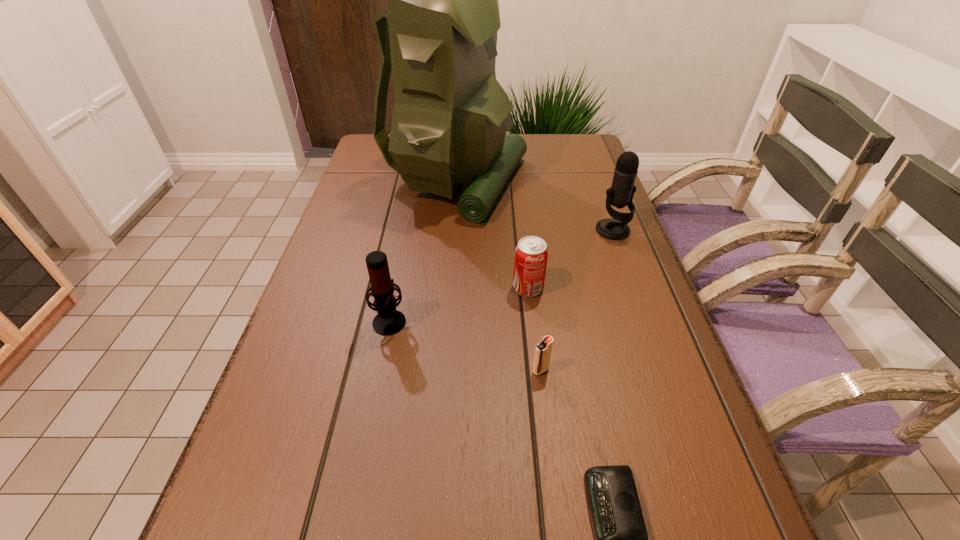
The image size is (960, 540). In order to click on object that ranks as the fourth closest to the second object from right to left in this screenshot , I will do `click(621, 193)`.